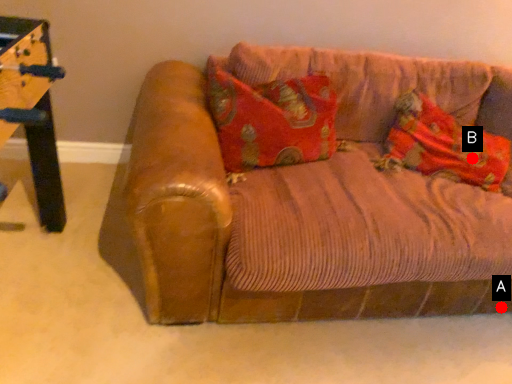
Question: Two points are circled on the image, labeled by A and B beside each circle. Which point is further to the camera?

Choices:
 (A) A is further
 (B) B is further

Answer: (B)